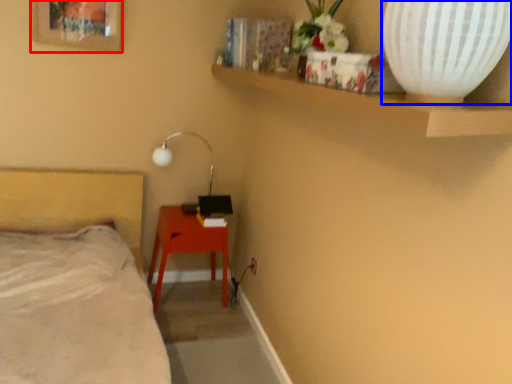
Question: Which object is further to the camera taking this photo, picture frame (highlighted by a red box) or vase (highlighted by a blue box)?

Choices:
 (A) picture frame
 (B) vase

Answer: (A)